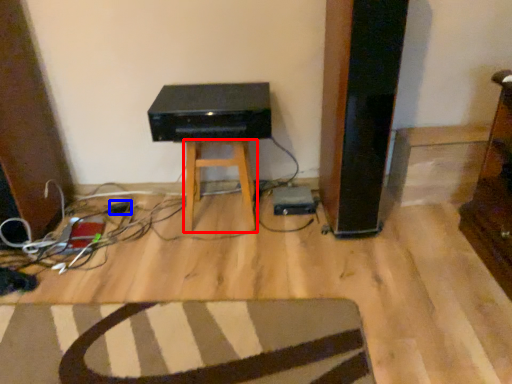
Question: Among these objects, which one is nearest to the camera, stool (highlighted by a red box) or plug (highlighted by a blue box)?

Choices:
 (A) stool
 (B) plug

Answer: (A)